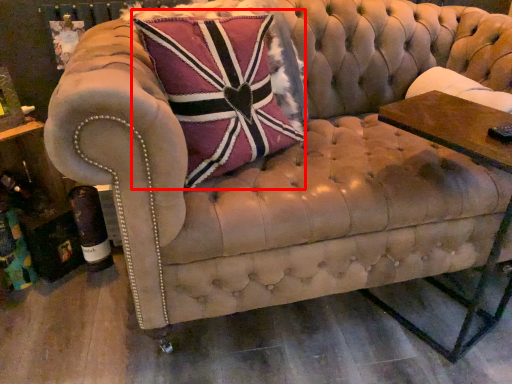
Question: Where is throw pillow (annotated by the red box) located in relation to side table in the image?

Choices:
 (A) left
 (B) right

Answer: (A)